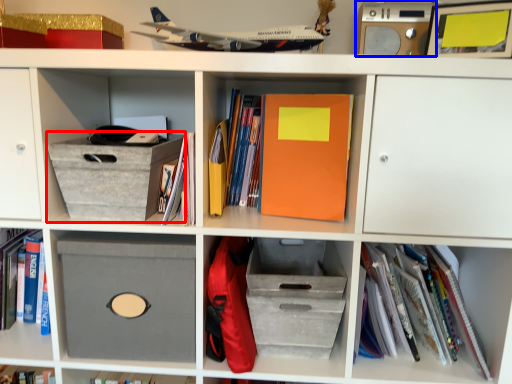
Question: Which object appears farthest to the camera in this image, cardboard box (highlighted by a red box) or speaker (highlighted by a blue box)?

Choices:
 (A) cardboard box
 (B) speaker

Answer: (B)